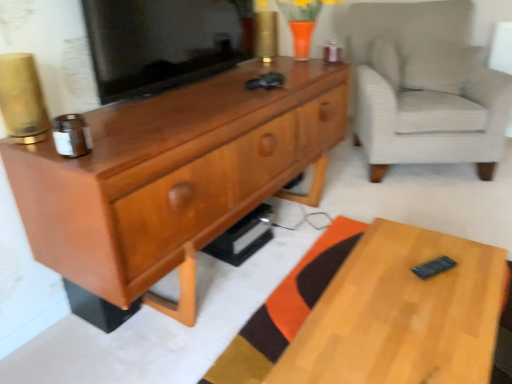
Where is `free space to the back side of light wood desk at lower right`? The image size is (512, 384). free space to the back side of light wood desk at lower right is located at coordinates (321, 244).